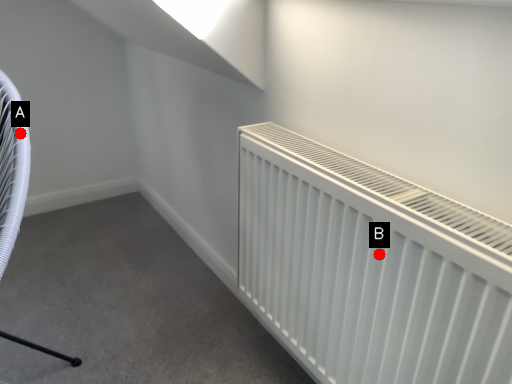
Question: Two points are circled on the image, labeled by A and B beside each circle. Which point is closer to the camera?

Choices:
 (A) A is closer
 (B) B is closer

Answer: (B)